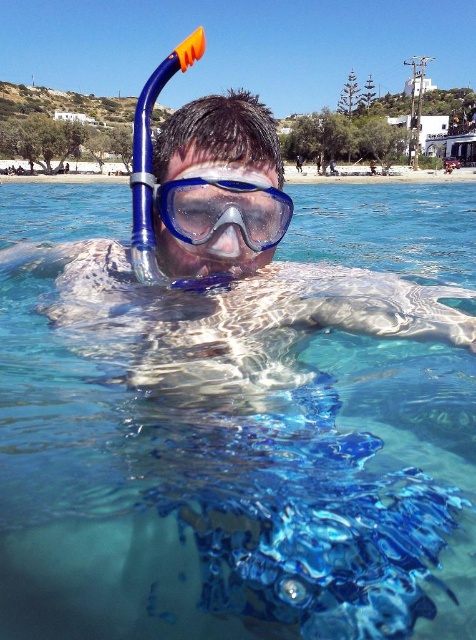
Question: Which of the following is the closest to the observer?

Choices:
 (A) (404, 324)
 (B) (160, 186)

Answer: (B)

Question: Is clear blue water at center smaller than blue matte/glossy goggles at center?

Choices:
 (A) yes
 (B) no

Answer: (B)

Question: Does clear blue water at center have a smaller size compared to blue matte/glossy goggles at center?

Choices:
 (A) no
 (B) yes

Answer: (A)

Question: Which of the following is the closest to the observer?

Choices:
 (A) clear blue water at center
 (B) blue matte/glossy goggles at center

Answer: (A)

Question: Among these points, which one is farthest from the camera?

Choices:
 (A) (119, 232)
 (B) (167, 218)

Answer: (A)

Question: Is clear blue water at center behind blue matte/glossy goggles at center?

Choices:
 (A) yes
 (B) no

Answer: (B)